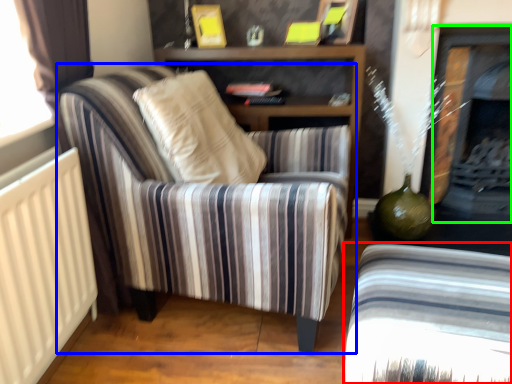
Question: Which object is the farthest from chair (highlighted by a red box)? Choose among these: chair (highlighted by a blue box) or fireplace (highlighted by a green box).

Choices:
 (A) chair
 (B) fireplace

Answer: (B)